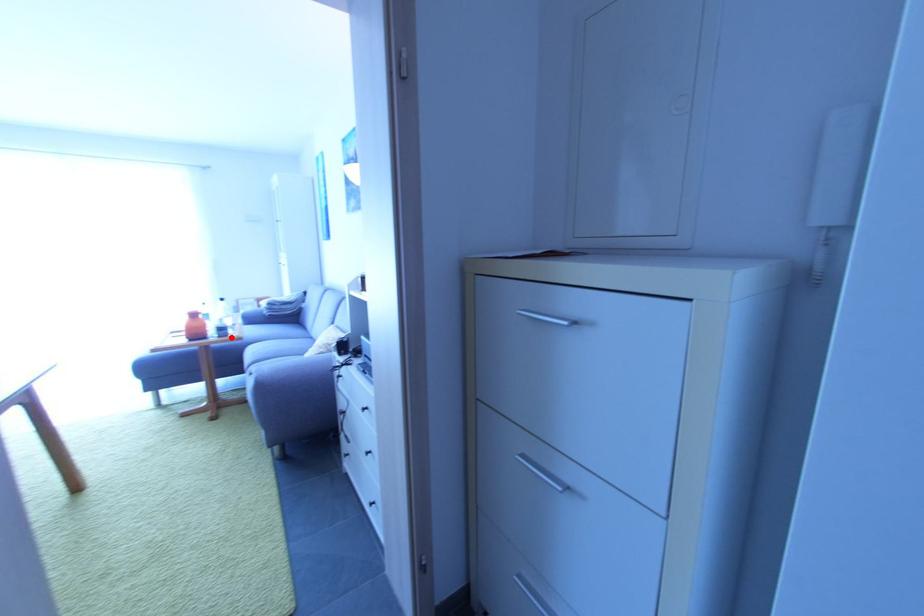
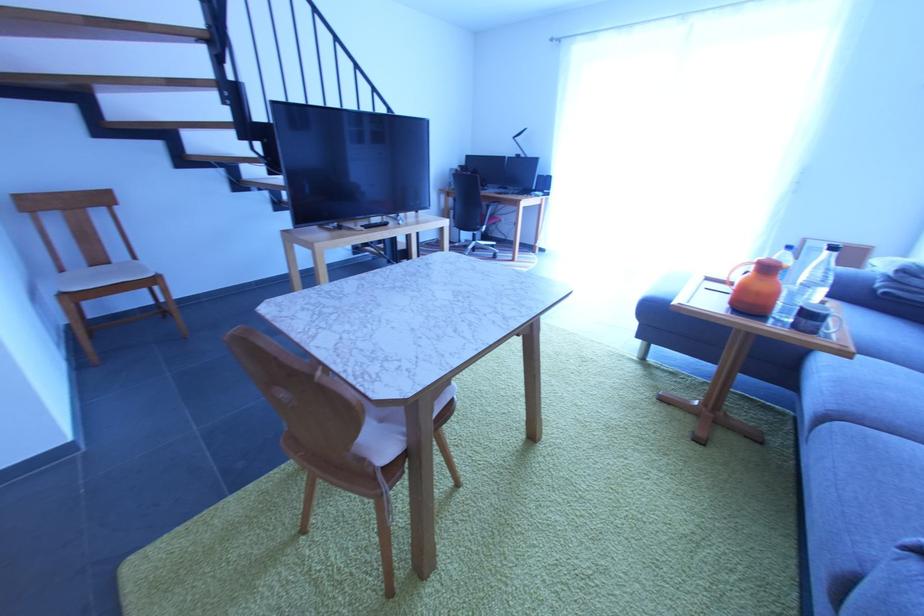
Where in the second image is the point corresponding to the highlighted location from the first image?

(819, 334)